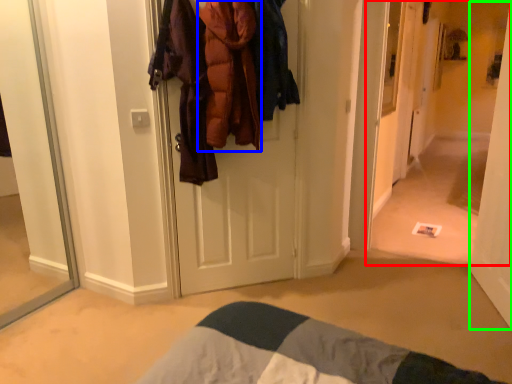
Question: Based on their relative distances, which object is nearer to corridor (highlighted by a red box)? Choose from clothing (highlighted by a blue box) and door (highlighted by a green box).

Choices:
 (A) clothing
 (B) door

Answer: (B)